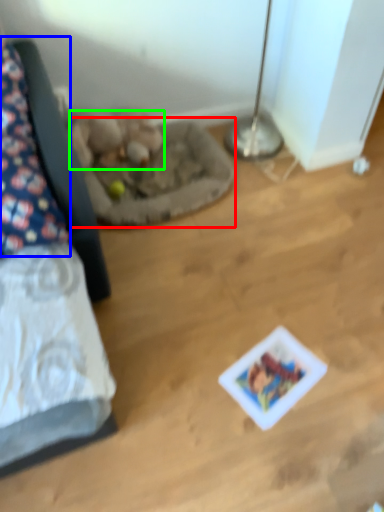
Question: Based on their relative distances, which object is nearer to cat bed (highlighted by a red box)? Choose from pillow (highlighted by a blue box) and animal (highlighted by a green box).

Choices:
 (A) pillow
 (B) animal

Answer: (B)